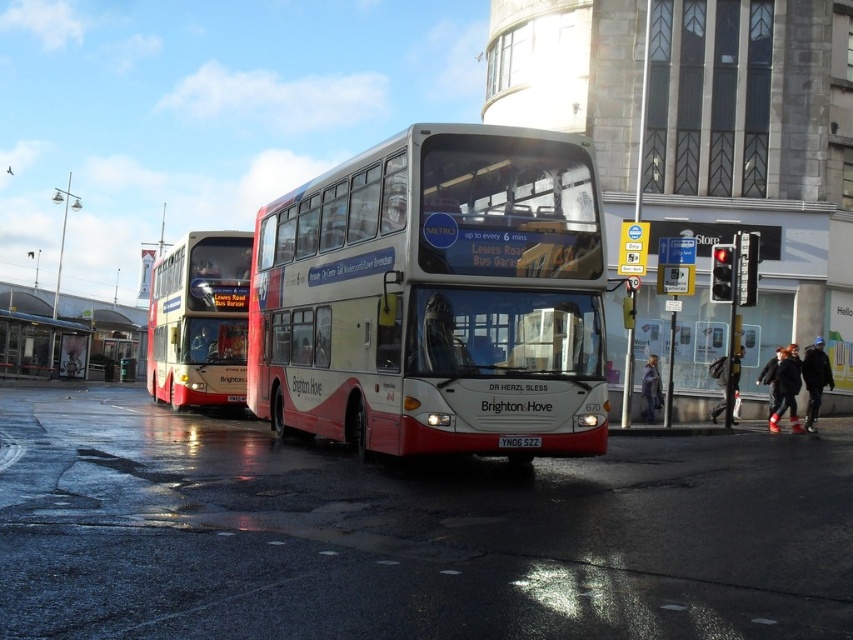
Question: Which of the following is the farthest from the observer?

Choices:
 (A) (184, 358)
 (B) (10, 365)

Answer: (B)

Question: Is matte red bus at left in front of metallic bus stop at lower left?

Choices:
 (A) yes
 (B) no

Answer: (A)

Question: Does white glossy bus at center lie behind metallic bus stop at lower left?

Choices:
 (A) yes
 (B) no

Answer: (B)

Question: Which of the following is the farthest from the observer?

Choices:
 (A) (521, 440)
 (B) (442, 170)
 (C) (33, 355)

Answer: (C)

Question: Is metallic bus stop at lower left wider than yellow matte license plate at center?

Choices:
 (A) yes
 (B) no

Answer: (A)

Question: Which object is positioned farthest from the metallic bus stop at lower left?

Choices:
 (A) yellow matte license plate at center
 (B) white glossy bus at center

Answer: (A)